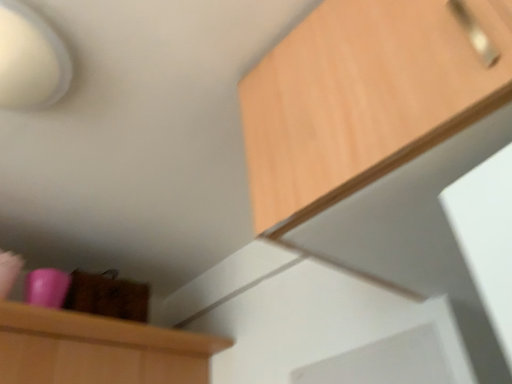
Question: Does wooden cabinet at upper right have a greater width compared to white matte lampshade at upper left?

Choices:
 (A) yes
 (B) no

Answer: (A)

Question: From the image's perspective, is wooden cabinet at upper right on top of white matte lampshade at upper left?

Choices:
 (A) yes
 (B) no

Answer: (B)

Question: Is wooden cabinet at upper right further to camera compared to white matte lampshade at upper left?

Choices:
 (A) no
 (B) yes

Answer: (A)

Question: Are wooden cabinet at upper right and white matte lampshade at upper left located far from each other?

Choices:
 (A) yes
 (B) no

Answer: (B)

Question: From a real-world perspective, does wooden cabinet at upper right sit lower than white matte lampshade at upper left?

Choices:
 (A) no
 (B) yes

Answer: (B)

Question: Is wooden cabinet at upper right shorter than white matte lampshade at upper left?

Choices:
 (A) yes
 (B) no

Answer: (B)

Question: Is white matte lampshade at upper left in front of wooden cabinet at upper right?

Choices:
 (A) yes
 (B) no

Answer: (B)

Question: Is white matte lampshade at upper left further to camera compared to wooden cabinet at upper right?

Choices:
 (A) no
 (B) yes

Answer: (B)

Question: Are white matte lampshade at upper left and wooden cabinet at upper right located far from each other?

Choices:
 (A) yes
 (B) no

Answer: (B)

Question: Can you confirm if white matte lampshade at upper left is bigger than wooden cabinet at upper right?

Choices:
 (A) yes
 (B) no

Answer: (B)

Question: Does white matte lampshade at upper left have a smaller size compared to wooden cabinet at upper right?

Choices:
 (A) yes
 (B) no

Answer: (A)

Question: Can you confirm if white matte lampshade at upper left is wider than wooden cabinet at upper right?

Choices:
 (A) yes
 (B) no

Answer: (B)

Question: Is white matte lampshade at upper left in front of or behind wooden cabinet at upper right in the image?

Choices:
 (A) behind
 (B) front

Answer: (A)